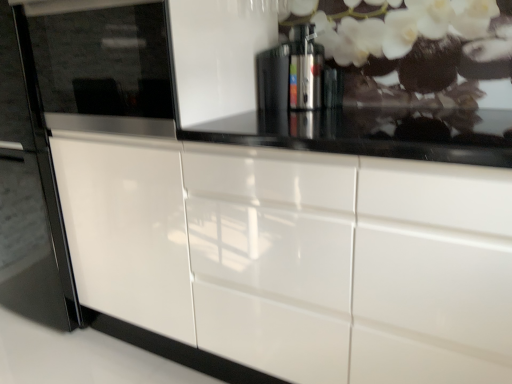
Question: Is the depth of glossy white cabinet at center less than that of glossy white fridge at left?

Choices:
 (A) no
 (B) yes

Answer: (B)

Question: Does glossy white cabinet at center have a greater height compared to glossy white fridge at left?

Choices:
 (A) yes
 (B) no

Answer: (B)

Question: From a real-world perspective, is glossy white cabinet at center on glossy white fridge at left?

Choices:
 (A) no
 (B) yes

Answer: (A)

Question: Is glossy white cabinet at center bigger than glossy white fridge at left?

Choices:
 (A) no
 (B) yes

Answer: (B)

Question: Can you confirm if glossy white cabinet at center is thinner than glossy white fridge at left?

Choices:
 (A) yes
 (B) no

Answer: (B)

Question: Is glossy white cabinet at center to the left of glossy white fridge at left from the viewer's perspective?

Choices:
 (A) yes
 (B) no

Answer: (B)

Question: From a real-world perspective, is glossy black microwave at left positioned under satin silver coffee machine at center based on gravity?

Choices:
 (A) no
 (B) yes

Answer: (A)

Question: Can you confirm if glossy black microwave at left is wider than satin silver coffee machine at center?

Choices:
 (A) no
 (B) yes

Answer: (B)

Question: Is glossy black microwave at left positioned with its back to satin silver coffee machine at center?

Choices:
 (A) yes
 (B) no

Answer: (B)

Question: Is glossy black microwave at left surrounding satin silver coffee machine at center?

Choices:
 (A) no
 (B) yes

Answer: (A)

Question: Can you confirm if glossy black microwave at left is smaller than satin silver coffee machine at center?

Choices:
 (A) no
 (B) yes

Answer: (A)

Question: Does glossy black microwave at left come in front of satin silver coffee machine at center?

Choices:
 (A) no
 (B) yes

Answer: (B)

Question: Is glossy white fridge at left located within glossy black microwave at left?

Choices:
 (A) yes
 (B) no

Answer: (B)